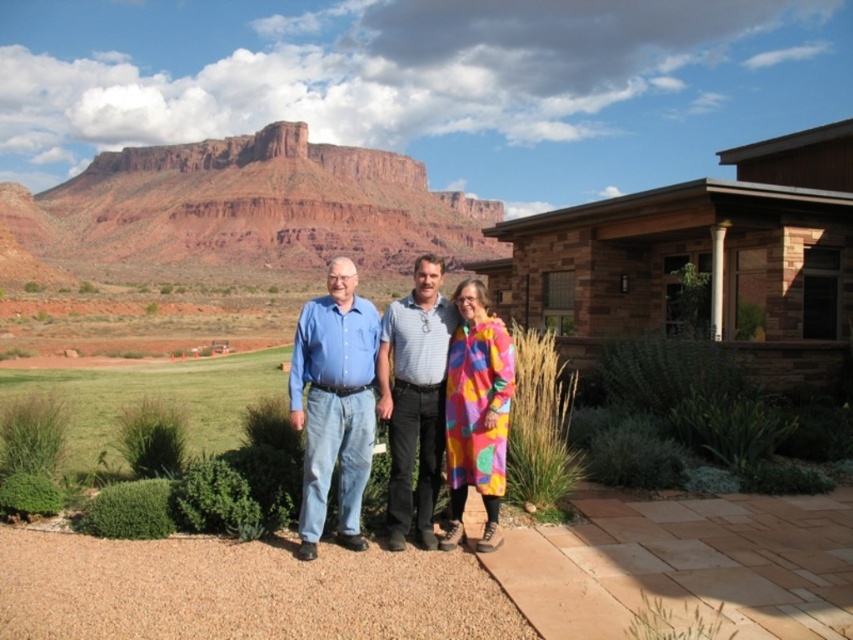
You are a photographer planning to take a group photo of the three people in front of the modern house. You want to ensure that the red rock cliff at upper center and the blue denim jeans at center are both visible in the frame. Based on their sizes, which object should appear larger in the photo?

The red rock cliff at upper center should appear larger in the photo because it is taller than the blue denim jeans at center.

You are a photographer trying to capture a clear shot of the gray textured shirt at center and the multicolored fabric coat at center. Which of the two items should you adjust your camera focus to ensure the subject in front is sharp?

The gray textured shirt at center is in front of the multicolored fabric coat at center. To ensure the subject in front is sharp, adjust the camera focus on the gray textured shirt at center.

You are standing on the paved area in front of the modern house. There is a point marked at coordinates (x=334, y=403). Which object is located at that point?

The point at coordinates (x=334, y=403) marks the location of the blue denim jeans at center.